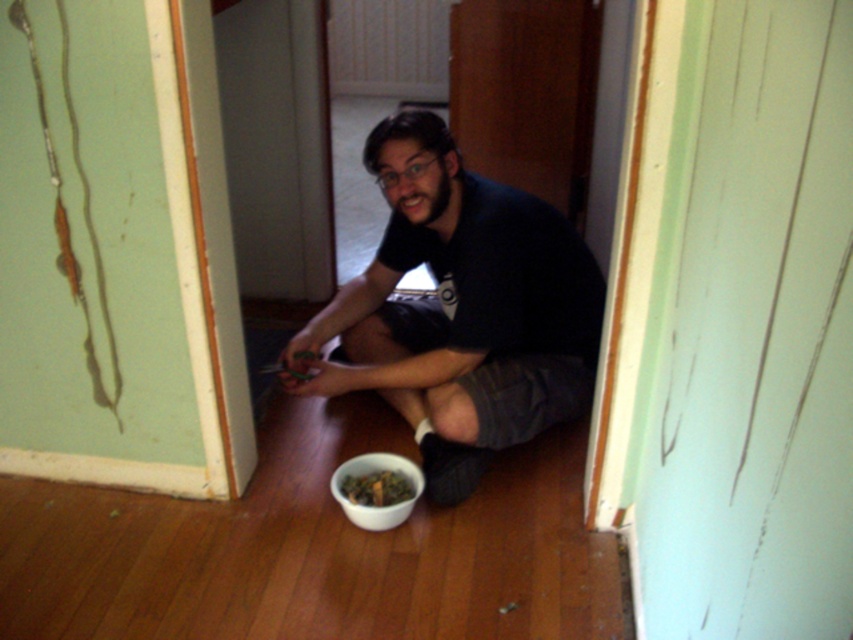
Question: Which of the following is the closest to the observer?

Choices:
 (A) (373, 476)
 (B) (479, 428)

Answer: (B)

Question: Among these points, which one is farthest from the camera?

Choices:
 (A) (405, 113)
 (B) (351, 488)

Answer: (B)

Question: Can you confirm if dark gray cotton shirt at center is positioned to the left of green leafy material bowl at lower center?

Choices:
 (A) no
 (B) yes

Answer: (A)

Question: Does dark gray cotton shirt at center have a greater width compared to green leafy material bowl at lower center?

Choices:
 (A) yes
 (B) no

Answer: (A)

Question: Does dark gray cotton shirt at center have a smaller size compared to green leafy material bowl at lower center?

Choices:
 (A) no
 (B) yes

Answer: (A)